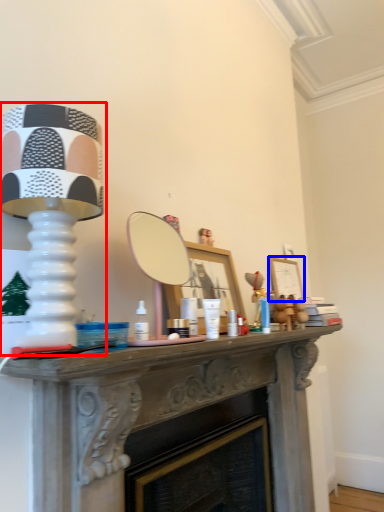
Question: Which object is closer to the camera taking this photo, table lamp (highlighted by a red box) or picture frame (highlighted by a blue box)?

Choices:
 (A) table lamp
 (B) picture frame

Answer: (A)